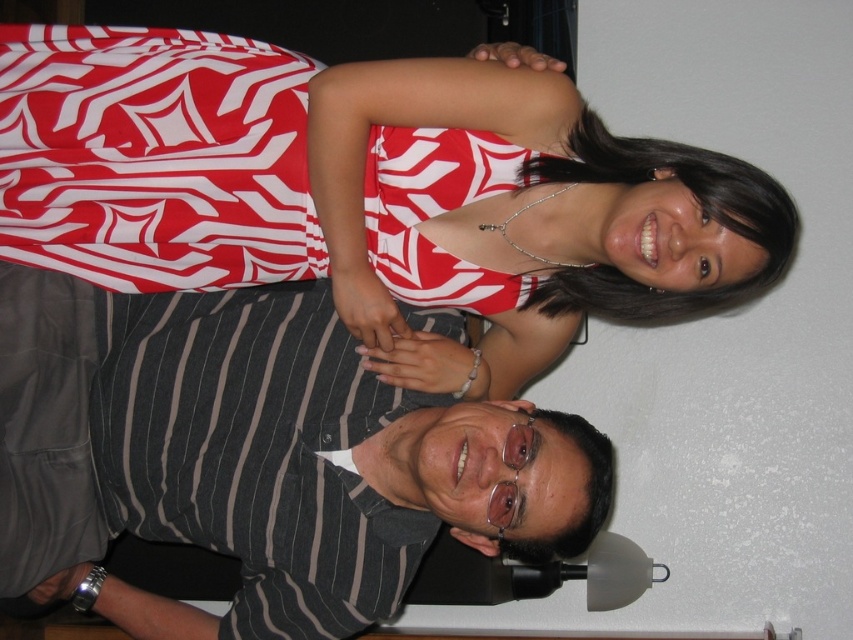
In the scene shown: Which is more to the right, white printed dress at upper center or striped cotton shirt at lower center?

white printed dress at upper center

Who is higher up, white printed dress at upper center or striped cotton shirt at lower center?

white printed dress at upper center is higher up.

Describe the element at coordinates (367, 189) in the screenshot. I see `white printed dress at upper center` at that location.

Find the location of a particular element. white printed dress at upper center is located at coordinates (367, 189).